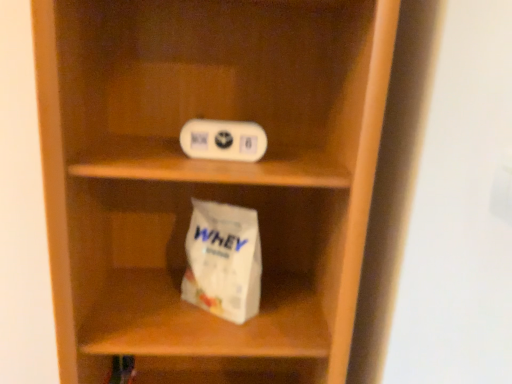
Question: Is point (96, 231) closer or farther from the camera than point (220, 274)?

Choices:
 (A) farther
 (B) closer

Answer: (A)

Question: From a real-world perspective, relative to white matte paper bag at lower center, is wooden shelf at center vertically above or below?

Choices:
 (A) above
 (B) below

Answer: (A)

Question: Estimate the real-world distances between objects in this image. Which object is closer to the white matte paper bag at lower center?

Choices:
 (A) wooden shelf at center
 (B) white plastic ipod at upper center

Answer: (A)

Question: Based on their relative distances, which object is farther from the white matte paper bag at lower center?

Choices:
 (A) white plastic ipod at upper center
 (B) wooden shelf at center

Answer: (A)